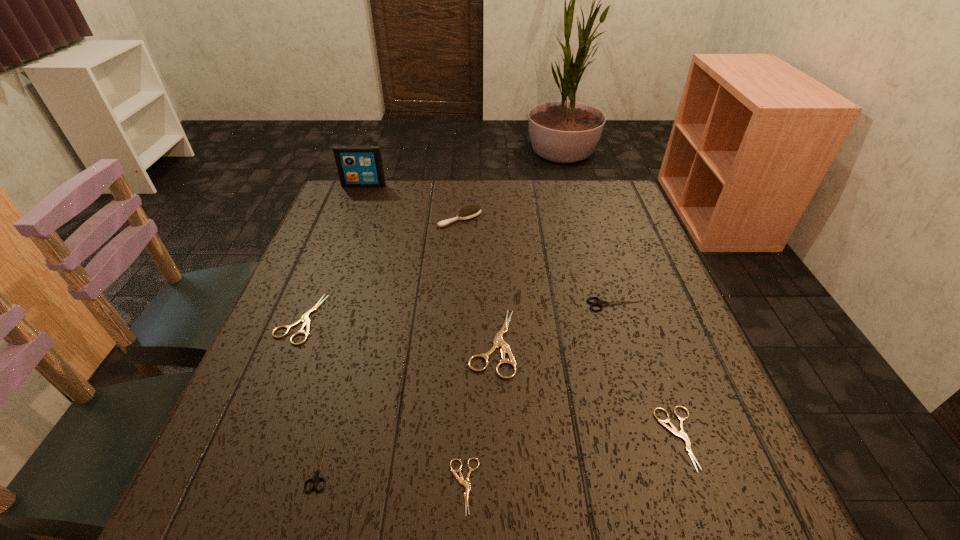
Locate an element on the screen. This screenshot has width=960, height=540. blank area at the right edge is located at coordinates (684, 377).

Locate an element on the screen. The image size is (960, 540). free region at the far left corner of the desktop is located at coordinates (364, 206).

Where is `vacant space at the near left corner`? The image size is (960, 540). vacant space at the near left corner is located at coordinates (272, 483).

Find the location of a particular element. The width and height of the screenshot is (960, 540). vacant space at the far right corner of the desktop is located at coordinates tap(614, 200).

This screenshot has width=960, height=540. I want to click on vacant point located between the seventh shortest object and the nearer black shears, so click(391, 341).

Locate an element on the screen. empty location between the biggest beige shears and the seventh shortest object is located at coordinates (476, 281).

This screenshot has width=960, height=540. In order to click on vacant space that's between the nearer black shears and the bigger black shears in this screenshot , I will do [x=468, y=384].

Locate an element on the screen. free space between the seventh nearest object and the biggest beige shears is located at coordinates (476, 281).

I want to click on empty space between the farther black shears and the iPod, so click(490, 245).

Image resolution: width=960 pixels, height=540 pixels. Find the location of `vacant space in between the biggest beige shears and the smaller black shears`. vacant space in between the biggest beige shears and the smaller black shears is located at coordinates [x=406, y=403].